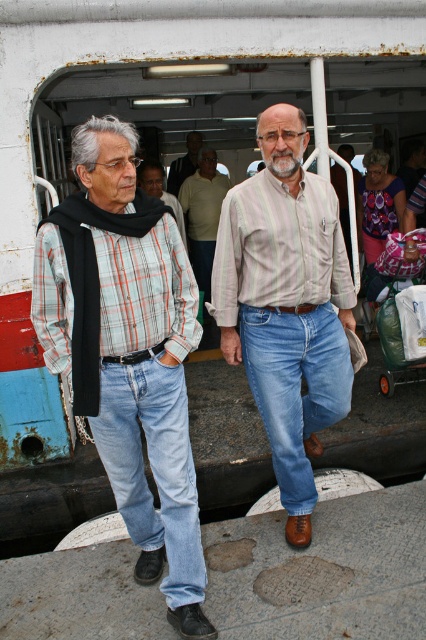
Does point (302, 154) come behind point (325, 337)?

That is False.

Does striped cotton shirt at center have a greater height compared to blue denim jeans at center?

Yes.

Image resolution: width=426 pixels, height=640 pixels. I want to click on striped cotton shirt at center, so click(x=287, y=305).

You are a GUI agent. You are given a task and a screenshot of the screen. Output one action in this format:
    pyautogui.click(x=<x>, y=<y>)
    Task: Click on the striped cotton shirt at center
    The width and height of the screenshot is (426, 640).
    Given the screenshot: What is the action you would take?
    pyautogui.click(x=287, y=305)

Can you confirm if striped cotton shirt at center is taller than plaid shirt at center?

Yes.

Is striped cotton shirt at center positioned behind plaid shirt at center?

No, it is in front of plaid shirt at center.

Which is in front, point (344, 355) or point (181, 220)?

Point (344, 355)

Find the location of a particular element. striped cotton shirt at center is located at coordinates (287, 305).

Who is shorter, light beige sweater at center or light brown shirt at center?

light brown shirt at center is shorter.

Is point (204, 156) farther from camera compared to point (198, 156)?

No.

The width and height of the screenshot is (426, 640). Identify the location of light beige sweater at center. (203, 214).